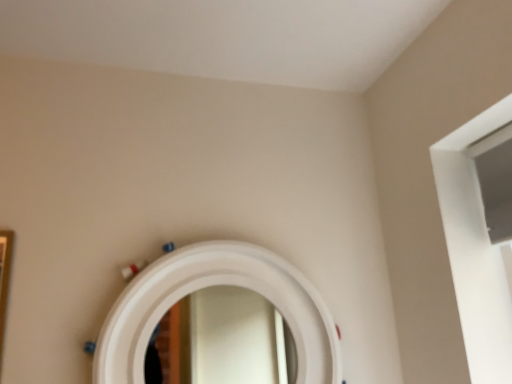
Question: Which is correct: white glossy mirror at center is inside gold metallic picture frame at left, or outside of it?

Choices:
 (A) inside
 (B) outside

Answer: (B)

Question: Is white glossy mirror at center in front of or behind gold metallic picture frame at left in the image?

Choices:
 (A) behind
 (B) front

Answer: (A)

Question: From a real-world perspective, is white glossy mirror at center positioned above or below gold metallic picture frame at left?

Choices:
 (A) above
 (B) below

Answer: (A)

Question: Choose the correct answer: Is gold metallic picture frame at left inside white glossy mirror at center or outside it?

Choices:
 (A) outside
 (B) inside

Answer: (A)

Question: Is point (10, 243) positioned closer to the camera than point (133, 350)?

Choices:
 (A) closer
 (B) farther

Answer: (B)

Question: From a real-world perspective, is gold metallic picture frame at left above or below white glossy mirror at center?

Choices:
 (A) below
 (B) above

Answer: (A)

Question: Is gold metallic picture frame at left in front of or behind white glossy mirror at center in the image?

Choices:
 (A) behind
 (B) front

Answer: (B)